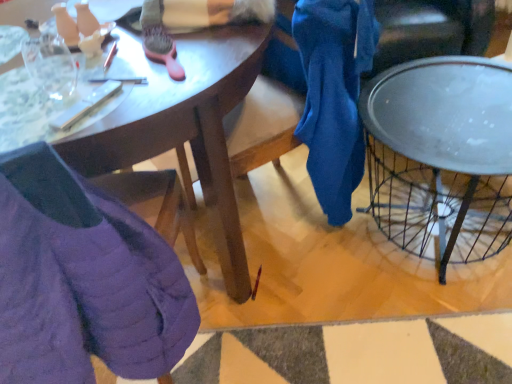
Question: From the image's perspective, does matte wooden desk at center appear lower than metallic silver tray at right?

Choices:
 (A) yes
 (B) no

Answer: (B)

Question: Is matte wooden desk at center oriented towards metallic silver tray at right?

Choices:
 (A) yes
 (B) no

Answer: (B)

Question: Can you confirm if matte wooden desk at center is thinner than metallic silver tray at right?

Choices:
 (A) no
 (B) yes

Answer: (A)

Question: Is matte wooden desk at center shorter than metallic silver tray at right?

Choices:
 (A) yes
 (B) no

Answer: (B)

Question: From a real-world perspective, is matte wooden desk at center under metallic silver tray at right?

Choices:
 (A) no
 (B) yes

Answer: (A)

Question: Is metallic silver tray at right wider or thinner than matte wooden desk at center?

Choices:
 (A) wide
 (B) thin

Answer: (B)

Question: From a real-world perspective, is metallic silver tray at right physically located above or below matte wooden desk at center?

Choices:
 (A) below
 (B) above

Answer: (A)

Question: Considering their positions, is metallic silver tray at right located in front of or behind matte wooden desk at center?

Choices:
 (A) behind
 (B) front

Answer: (A)

Question: Considering the positions of metallic silver tray at right and matte wooden desk at center in the image, is metallic silver tray at right taller or shorter than matte wooden desk at center?

Choices:
 (A) short
 (B) tall

Answer: (A)

Question: Considering the positions of matte wooden desk at center and purple quilted jacket at lower left in the image, is matte wooden desk at center bigger or smaller than purple quilted jacket at lower left?

Choices:
 (A) small
 (B) big

Answer: (B)

Question: Would you say matte wooden desk at center is to the left or to the right of purple quilted jacket at lower left in the picture?

Choices:
 (A) left
 (B) right

Answer: (B)

Question: Considering the positions of matte wooden desk at center and purple quilted jacket at lower left in the image, is matte wooden desk at center taller or shorter than purple quilted jacket at lower left?

Choices:
 (A) short
 (B) tall

Answer: (B)

Question: From the image's perspective, relative to purple quilted jacket at lower left, is matte wooden desk at center above or below?

Choices:
 (A) below
 (B) above

Answer: (B)

Question: In terms of height, does matte wooden desk at center look taller or shorter compared to metallic silver tray at right?

Choices:
 (A) tall
 (B) short

Answer: (A)

Question: Considering the positions of matte wooden desk at center and metallic silver tray at right in the image, is matte wooden desk at center wider or thinner than metallic silver tray at right?

Choices:
 (A) wide
 (B) thin

Answer: (A)